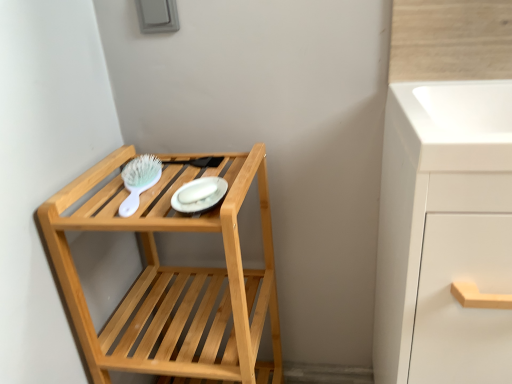
Question: From a real-world perspective, is white matte cabinet at right located higher than natural wood shelf at left?

Choices:
 (A) no
 (B) yes

Answer: (B)

Question: Does white matte cabinet at right have a smaller size compared to natural wood shelf at left?

Choices:
 (A) no
 (B) yes

Answer: (A)

Question: Is white matte cabinet at right further to the viewer compared to natural wood shelf at left?

Choices:
 (A) no
 (B) yes

Answer: (A)

Question: Does white matte cabinet at right have a greater width compared to natural wood shelf at left?

Choices:
 (A) yes
 (B) no

Answer: (A)

Question: Is white matte cabinet at right closer to the viewer compared to natural wood shelf at left?

Choices:
 (A) no
 (B) yes

Answer: (B)

Question: Visually, is white matte cabinet at right positioned to the left or to the right of white glossy platter at center?

Choices:
 (A) right
 (B) left

Answer: (A)

Question: Considering the positions of point (439, 269) and point (202, 198), is point (439, 269) closer or farther from the camera than point (202, 198)?

Choices:
 (A) closer
 (B) farther

Answer: (A)

Question: Is white matte cabinet at right inside the boundaries of white glossy platter at center, or outside?

Choices:
 (A) outside
 (B) inside

Answer: (A)

Question: From a real-world perspective, is white matte cabinet at right above or below white glossy platter at center?

Choices:
 (A) above
 (B) below

Answer: (B)

Question: Does point (78, 339) appear closer or farther from the camera than point (159, 162)?

Choices:
 (A) closer
 (B) farther

Answer: (A)

Question: Would you say natural wood shelf at left is to the left or to the right of green plastic brush at upper left in the picture?

Choices:
 (A) left
 (B) right

Answer: (B)

Question: Is natural wood shelf at left in front of or behind green plastic brush at upper left in the image?

Choices:
 (A) front
 (B) behind

Answer: (A)

Question: Considering the positions of natural wood shelf at left and green plastic brush at upper left in the image, is natural wood shelf at left bigger or smaller than green plastic brush at upper left?

Choices:
 (A) big
 (B) small

Answer: (A)

Question: Looking at their shapes, would you say green plastic brush at upper left is wider or thinner than natural wood shelf at left?

Choices:
 (A) wide
 (B) thin

Answer: (B)

Question: Considering the positions of point (126, 168) and point (179, 225), is point (126, 168) closer or farther from the camera than point (179, 225)?

Choices:
 (A) closer
 (B) farther

Answer: (B)